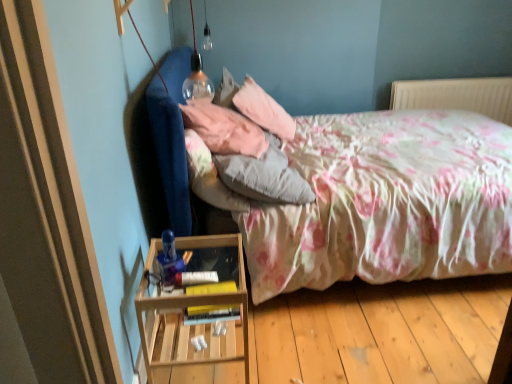
Question: Is pink fabric pillow at upper center, the 2th pillow in the back-to-front sequence, not within pink soft pillow at upper center, the 3th pillow in the front-to-back sequence?

Choices:
 (A) yes
 (B) no

Answer: (A)

Question: Is pink fabric pillow at upper center, the 2th pillow in the front-to-back sequence, closer to the viewer compared to pink soft pillow at upper center, the 3th pillow in the front-to-back sequence?

Choices:
 (A) no
 (B) yes

Answer: (B)

Question: From the image's perspective, would you say pink fabric pillow at upper center, the 2th pillow in the back-to-front sequence, is positioned over pink soft pillow at upper center, the 3th pillow in the front-to-back sequence?

Choices:
 (A) yes
 (B) no

Answer: (B)

Question: Considering the relative sizes of pink fabric pillow at upper center, the 2th pillow in the front-to-back sequence, and pink soft pillow at upper center, placed as the first pillow when sorted from back to front, in the image provided, is pink fabric pillow at upper center, the 2th pillow in the front-to-back sequence, smaller than pink soft pillow at upper center, placed as the first pillow when sorted from back to front,?

Choices:
 (A) yes
 (B) no

Answer: (A)

Question: Is pink fabric pillow at upper center, the 2th pillow in the back-to-front sequence, far from pink soft pillow at upper center, placed as the first pillow when sorted from back to front?

Choices:
 (A) yes
 (B) no

Answer: (B)

Question: Relative to white plastic radiator at upper right, is fluffy white pillow at center, which ranks as the 3th pillow in back-to-front order, in front or behind?

Choices:
 (A) behind
 (B) front

Answer: (B)

Question: In terms of height, does fluffy white pillow at center, which is the first pillow in front-to-back order, look taller or shorter compared to white plastic radiator at upper right?

Choices:
 (A) tall
 (B) short

Answer: (B)

Question: Is fluffy white pillow at center, which ranks as the 3th pillow in back-to-front order, inside the boundaries of white plastic radiator at upper right, or outside?

Choices:
 (A) outside
 (B) inside

Answer: (A)

Question: Considering the positions of fluffy white pillow at center, which is the first pillow in front-to-back order, and white plastic radiator at upper right in the image, is fluffy white pillow at center, which is the first pillow in front-to-back order, bigger or smaller than white plastic radiator at upper right?

Choices:
 (A) big
 (B) small

Answer: (A)

Question: Does point (454, 117) appear closer or farther from the camera than point (162, 309)?

Choices:
 (A) closer
 (B) farther

Answer: (B)

Question: From the image's perspective, is floral fabric bed at center positioned above or below wooden at left?

Choices:
 (A) below
 (B) above

Answer: (B)

Question: In terms of size, does floral fabric bed at center appear bigger or smaller than wooden at left?

Choices:
 (A) big
 (B) small

Answer: (A)

Question: Based on their positions, is floral fabric bed at center located to the left or right of wooden at left?

Choices:
 (A) left
 (B) right

Answer: (B)

Question: Is wooden at left wider or thinner than white plastic radiator at upper right?

Choices:
 (A) wide
 (B) thin

Answer: (A)

Question: Considering the relative positions of wooden at left and white plastic radiator at upper right in the image provided, is wooden at left to the left or to the right of white plastic radiator at upper right?

Choices:
 (A) left
 (B) right

Answer: (A)